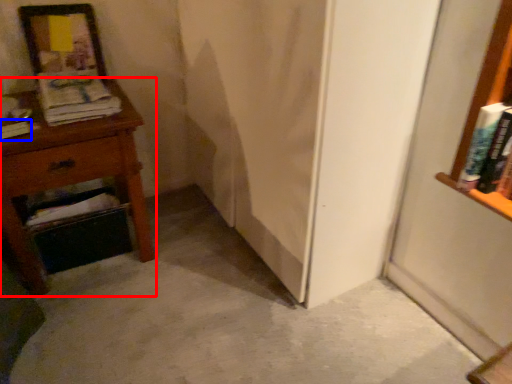
Question: Which object is further to the camera taking this photo, nightstand (highlighted by a red box) or book (highlighted by a blue box)?

Choices:
 (A) nightstand
 (B) book

Answer: (B)